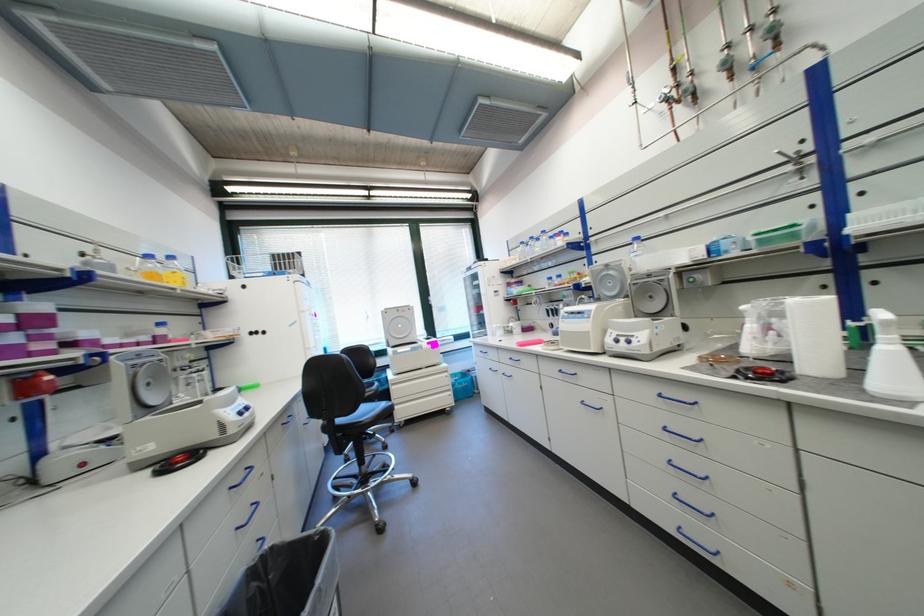
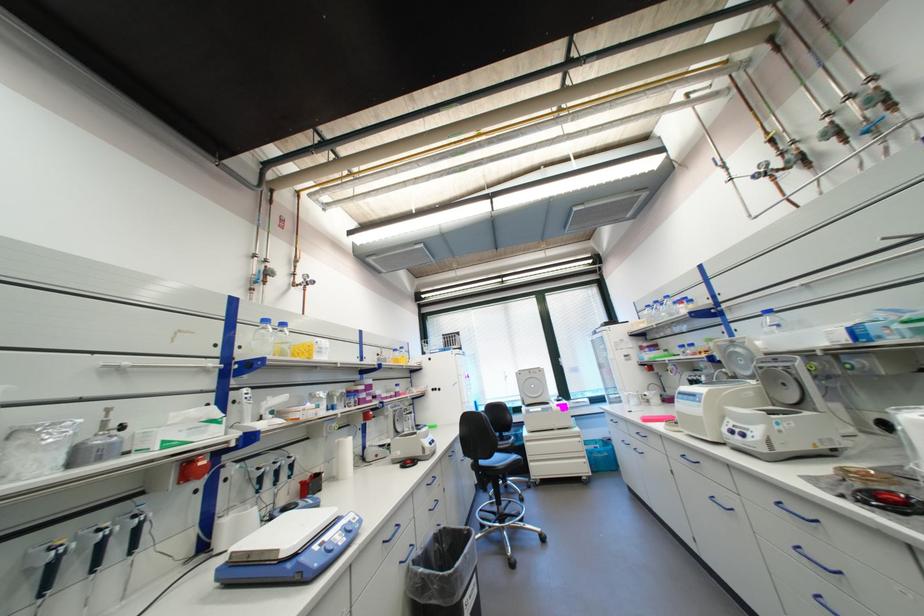
Where in the second image is the point corresponding to pixel 226 523 from the first image?

(431, 501)